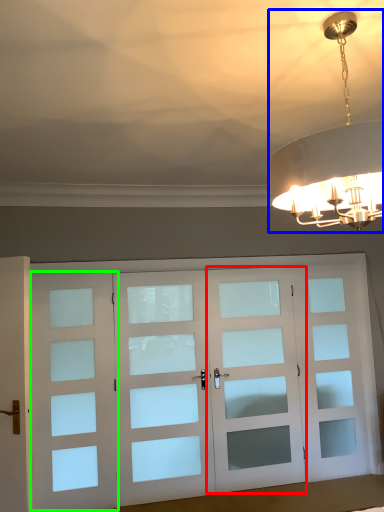
Question: Which object is the closest to the screen door (highlighted by a red box)? Choose among these: lamp (highlighted by a blue box) or screen door (highlighted by a green box).

Choices:
 (A) lamp
 (B) screen door

Answer: (B)